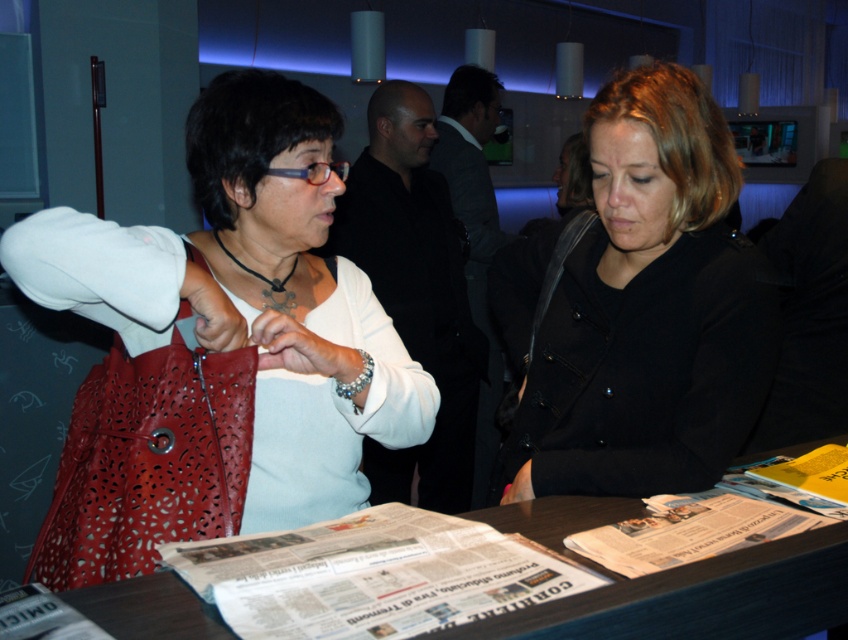
Question: Estimate the real-world distances between objects in this image. Which object is farther from the white glossy newspaper at center?

Choices:
 (A) wooden table at center
 (B) matte leather bag at left

Answer: (B)

Question: Which object appears farthest from the camera in this image?

Choices:
 (A) matte leather bag at left
 (B) black matte coat at center

Answer: (B)

Question: Observing the image, what is the correct spatial positioning of matte leather bag at left in reference to white glossy newspaper at center?

Choices:
 (A) below
 (B) above

Answer: (B)

Question: Is matte leather bag at left closer to the viewer compared to white glossy newspaper at center?

Choices:
 (A) no
 (B) yes

Answer: (A)

Question: Is white glossy newspaper at center thinner than wooden table at center?

Choices:
 (A) no
 (B) yes

Answer: (B)

Question: Which object is positioned closest to the matte leather bag at left?

Choices:
 (A) black matte coat at center
 (B) wooden table at center

Answer: (B)